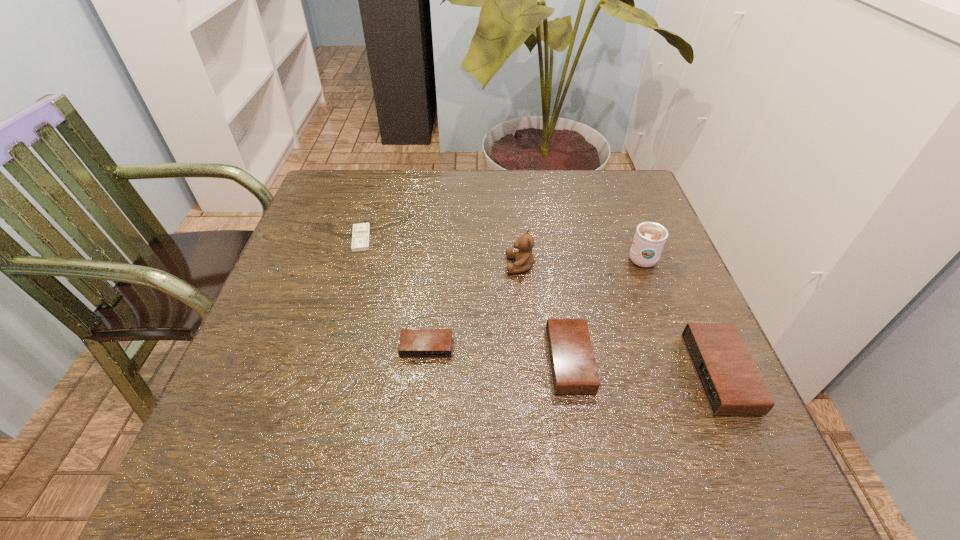
Identify the location of free space between the second tallest alarm clock and the leftmost alarm clock. (498, 354).

Locate which object ranks in proximity to the fifth tallest object. Please provide its 2D coordinates. Your answer should be formatted as a tuple, i.e. [(x, y)], where the tuple contains the x and y coordinates of a point satisfying the conditions above.

[(573, 367)]

At what (x,y) coordinates should I click in order to perform the action: click on object that ranks as the second closest to the third object from right to left. Please return your answer as a coordinate pair (x, y). The width and height of the screenshot is (960, 540). Looking at the image, I should click on (414, 343).

Locate which alarm clock is the third closest to the cup. Please provide its 2D coordinates. Your answer should be formatted as a tuple, i.e. [(x, y)], where the tuple contains the x and y coordinates of a point satisfying the conditions above.

[(414, 343)]

What are the coordinates of `alarm clock that stands as the closest to the teddy bear` in the screenshot? It's located at (573, 367).

Image resolution: width=960 pixels, height=540 pixels. Find the location of `free location that satisfies the following two spatial constraints: 1. on the front-facing side of the teddy bear; 2. on the front face of the shortest alarm clock`. free location that satisfies the following two spatial constraints: 1. on the front-facing side of the teddy bear; 2. on the front face of the shortest alarm clock is located at coordinates (528, 348).